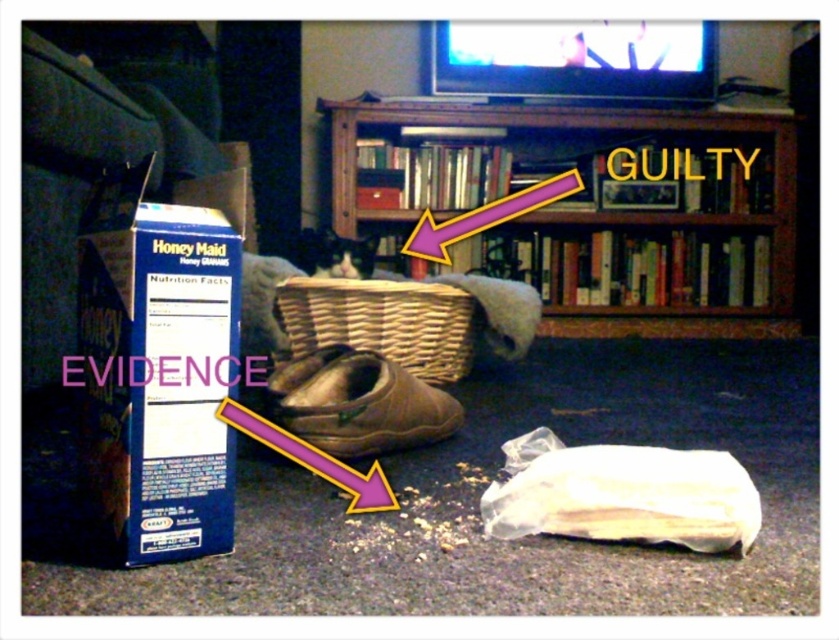
Question: Is the position of wooden bookcase at upper center less distant than that of woven brown basket at center?

Choices:
 (A) no
 (B) yes

Answer: (A)

Question: Does wooden bookcase at upper center appear over woven brown basket at center?

Choices:
 (A) yes
 (B) no

Answer: (A)

Question: Which of the following is the farthest from the observer?

Choices:
 (A) woven brown basket at center
 (B) wooden bookcase at upper center

Answer: (B)

Question: Observing the image, what is the correct spatial positioning of wooden bookcase at upper center in reference to woven brown basket at center?

Choices:
 (A) right
 (B) left

Answer: (A)